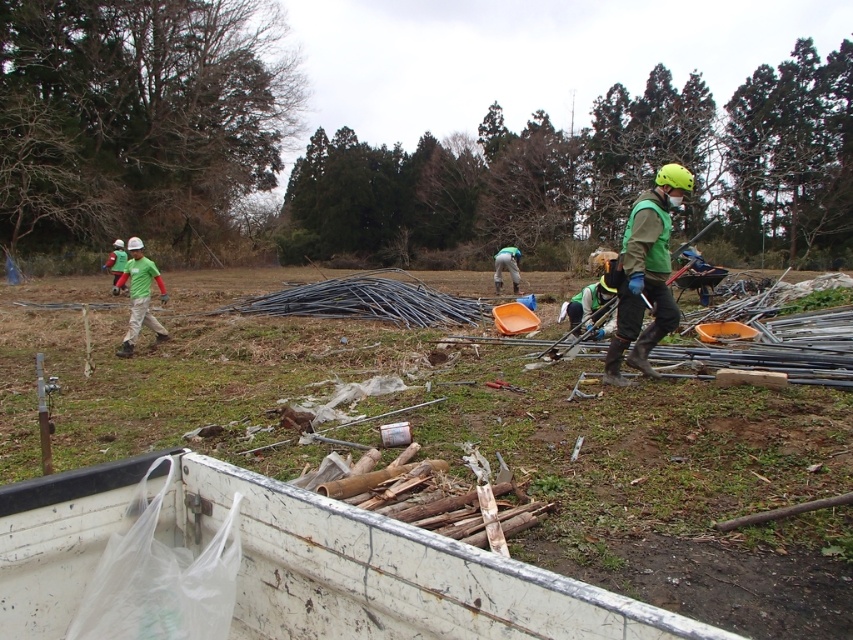
In the scene shown: Which is more to the left, smooth metal rods at center or green fabric shirt at left?

From the viewer's perspective, green fabric shirt at left appears more on the left side.

Between point (788, 554) and point (138, 324), which one is positioned in front?

Positioned in front is point (788, 554).

At what (x,y) coordinates should I click in order to perform the action: click on smooth metal rods at center. Please return your answer as a coordinate pair (x, y). The width and height of the screenshot is (853, 640). Looking at the image, I should click on (466, 438).

The width and height of the screenshot is (853, 640). What do you see at coordinates (466, 438) in the screenshot? I see `smooth metal rods at center` at bounding box center [466, 438].

Who is more distant from viewer, (761, 435) or (509, 253)?

The point (509, 253) is more distant.

The image size is (853, 640). In order to click on smooth metal rods at center in this screenshot , I will do 466,438.

Can you confirm if green fabric shirt at left is thinner than green fabric worker at center?

In fact, green fabric shirt at left might be wider than green fabric worker at center.

Who is taller, green fabric shirt at left or green fabric worker at center?

With more height is green fabric shirt at left.

Who is more forward, (132, 321) or (512, 246)?

Positioned in front is point (132, 321).

Find the location of a particular element. The width and height of the screenshot is (853, 640). green fabric shirt at left is located at coordinates (138, 296).